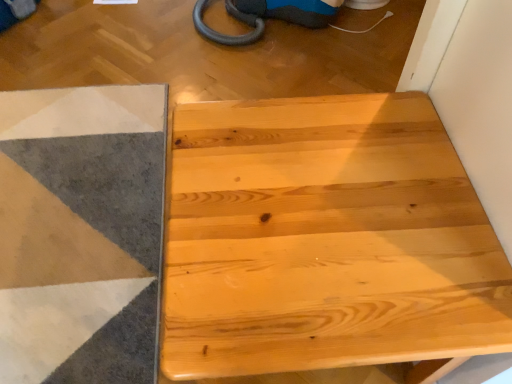
At what (x,y) coordinates should I click in order to perform the action: click on soft gray carpet at lower left. Please return your answer as a coordinate pair (x, y). The height and width of the screenshot is (384, 512). Looking at the image, I should click on (80, 233).

Describe the element at coordinates (80, 233) in the screenshot. Image resolution: width=512 pixels, height=384 pixels. I see `soft gray carpet at lower left` at that location.

In the scene shown: Measure the distance between soft gray carpet at lower left and camera.

The depth of soft gray carpet at lower left is 1.01 meters.

This screenshot has width=512, height=384. What do you see at coordinates (325, 241) in the screenshot? I see `natural wood table at center` at bounding box center [325, 241].

You are a GUI agent. You are given a task and a screenshot of the screen. Output one action in this format:
    pyautogui.click(x=<x>, y=<y>)
    Task: Click on the natural wood table at center
    This screenshot has width=512, height=384.
    Given the screenshot: What is the action you would take?
    pyautogui.click(x=325, y=241)

The image size is (512, 384). In order to click on soft gray carpet at lower left in this screenshot , I will do `click(80, 233)`.

Which is more to the right, soft gray carpet at lower left or natural wood table at center?

From the viewer's perspective, natural wood table at center appears more on the right side.

Is soft gray carpet at lower left in front of or behind natural wood table at center in the image?

Visually, soft gray carpet at lower left is located behind natural wood table at center.

Does point (77, 286) come behind point (267, 216)?

That is True.

From the image's perspective, which object appears higher, soft gray carpet at lower left or natural wood table at center?

soft gray carpet at lower left appears higher in the image.

From a real-world perspective, between soft gray carpet at lower left and natural wood table at center, who is vertically lower?

soft gray carpet at lower left.

Which object is wider, soft gray carpet at lower left or natural wood table at center?

Wider between the two is soft gray carpet at lower left.

Considering the sizes of objects soft gray carpet at lower left and natural wood table at center in the image provided, who is shorter, soft gray carpet at lower left or natural wood table at center?

Standing shorter between the two is soft gray carpet at lower left.

Is soft gray carpet at lower left bigger than natural wood table at center?

No.

Is natural wood table at center completely or partially inside soft gray carpet at lower left?

No, natural wood table at center is not inside soft gray carpet at lower left.

Are soft gray carpet at lower left and natural wood table at center located far from each other?

Actually, soft gray carpet at lower left and natural wood table at center are a little close together.

Is soft gray carpet at lower left facing away from natural wood table at center?

That's not correct — soft gray carpet at lower left is not looking away from natural wood table at center.

How many degrees apart are the facing directions of soft gray carpet at lower left and natural wood table at center?

There is a 180-degree angle between the facing directions of soft gray carpet at lower left and natural wood table at center.

How much distance is there between soft gray carpet at lower left and natural wood table at center?

soft gray carpet at lower left is 23.47 inches away from natural wood table at center.

Image resolution: width=512 pixels, height=384 pixels. I want to click on ramp beneath the natural wood table at center (from a real-world perspective), so click(80, 233).

Which object is positioned more to the left, natural wood table at center or soft gray carpet at lower left?

From the viewer's perspective, soft gray carpet at lower left appears more on the left side.

Does natural wood table at center lie behind soft gray carpet at lower left?

No.

Considering the positions of points (418, 193) and (26, 148), is point (418, 193) farther from camera compared to point (26, 148)?

That is False.

From the image's perspective, between natural wood table at center and soft gray carpet at lower left, who is located below?

natural wood table at center appears lower in the image.

Looking at this image, from a real-world perspective, is natural wood table at center located higher than soft gray carpet at lower left?

Yes, from a real-world perspective, natural wood table at center is on top of soft gray carpet at lower left.

Considering the sizes of natural wood table at center and soft gray carpet at lower left in the image, is natural wood table at center wider or thinner than soft gray carpet at lower left?

In the image, natural wood table at center appears to be more narrow than soft gray carpet at lower left.

Which of these two, natural wood table at center or soft gray carpet at lower left, stands taller?

With more height is natural wood table at center.

Considering the relative sizes of natural wood table at center and soft gray carpet at lower left in the image provided, is natural wood table at center smaller than soft gray carpet at lower left?

No, natural wood table at center is not smaller than soft gray carpet at lower left.

Is natural wood table at center completely or partially outside of soft gray carpet at lower left?

Yes, natural wood table at center is located beyond the bounds of soft gray carpet at lower left.

Are natural wood table at center and soft gray carpet at lower left far apart?

No, natural wood table at center is in close proximity to soft gray carpet at lower left.

Is soft gray carpet at lower left at the back of natural wood table at center?

That's not correct — natural wood table at center is not looking away from soft gray carpet at lower left.

How different are the orientations of natural wood table at center and soft gray carpet at lower left in degrees?

The angular difference between natural wood table at center and soft gray carpet at lower left is 180 degrees.

Looking at this image, how far apart are natural wood table at center and soft gray carpet at lower left?

natural wood table at center is 23.47 inches away from soft gray carpet at lower left.

At what (x,y) coordinates should I click in order to perform the action: click on table located below the soft gray carpet at lower left (from the image's perspective). Please return your answer as a coordinate pair (x, y). Image resolution: width=512 pixels, height=384 pixels. Looking at the image, I should click on (325, 241).

Where is `table in front of the soft gray carpet at lower left`? table in front of the soft gray carpet at lower left is located at coordinates (325, 241).

Locate an element on the screen. The image size is (512, 384). table on the right side of soft gray carpet at lower left is located at coordinates (325, 241).